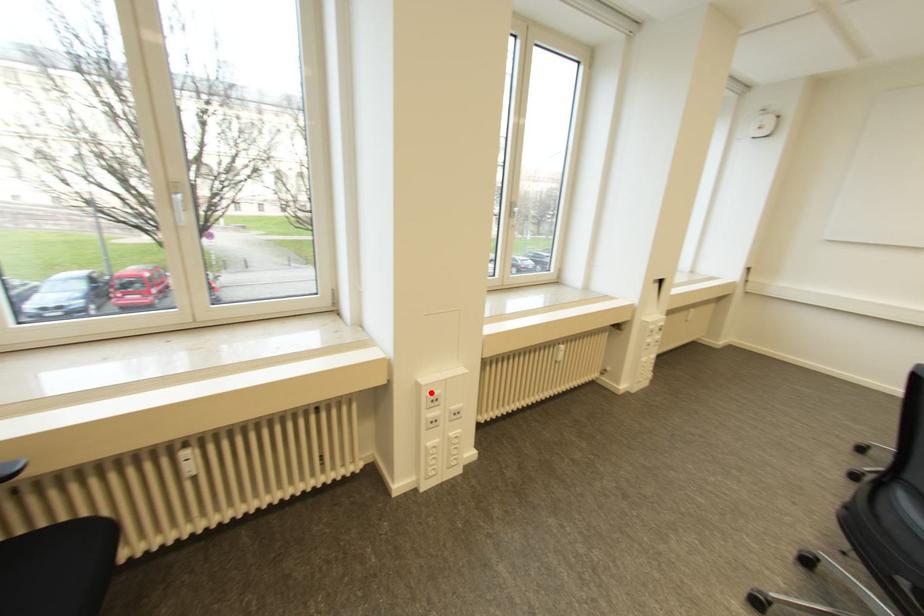
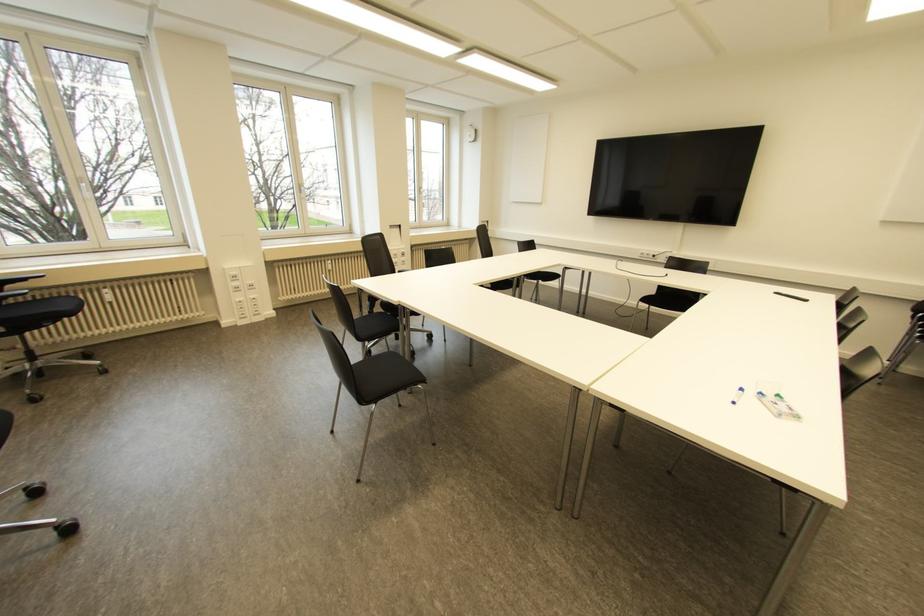
Locate, in the second image, the point that corresponds to the highlighted location in the first image.

(232, 273)